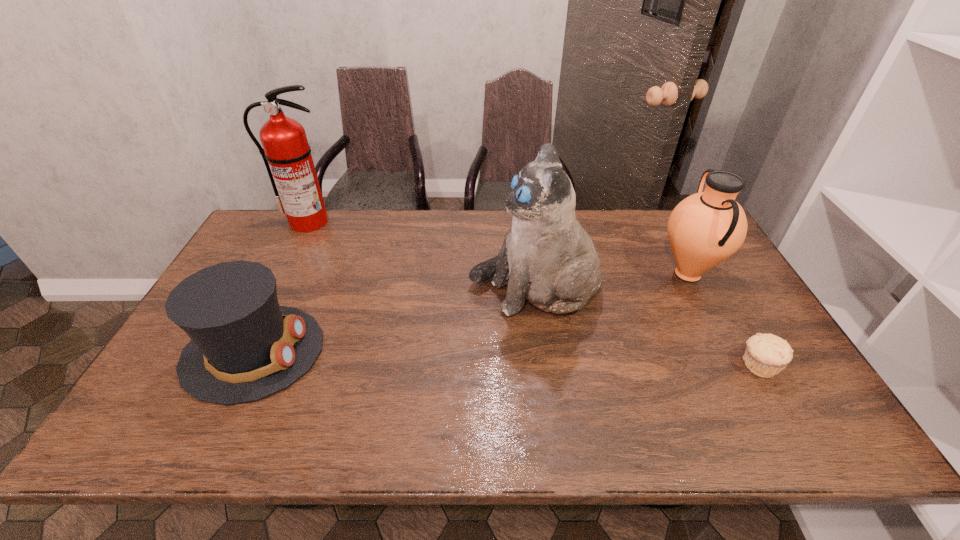
Where is `fire extinguisher`? fire extinguisher is located at coordinates (286, 153).

I want to click on the third object from right to left, so click(x=547, y=257).

Identify the location of pitcher. The image size is (960, 540). (704, 229).

Locate an element on the screen. The width and height of the screenshot is (960, 540). dress hat is located at coordinates (244, 347).

Where is `the shortest object`? Image resolution: width=960 pixels, height=540 pixels. the shortest object is located at coordinates (766, 355).

Find the location of a particular element. The image size is (960, 540). vacant region located 0.310m at the nozzle of the fire extinguisher is located at coordinates (271, 296).

This screenshot has width=960, height=540. Find the location of `vacant space located 0.400m at the face of the third object from left to right`. vacant space located 0.400m at the face of the third object from left to right is located at coordinates (333, 289).

Identify the location of free region located 0.200m at the face of the third object from left to right. Image resolution: width=960 pixels, height=540 pixels. (401, 289).

Where is `vacant area situated 0.380m at the face of the third object from left to right`? Image resolution: width=960 pixels, height=540 pixels. vacant area situated 0.380m at the face of the third object from left to right is located at coordinates (340, 289).

Where is `vacant space situated on the front of the pitcher`? This screenshot has height=540, width=960. vacant space situated on the front of the pitcher is located at coordinates (744, 381).